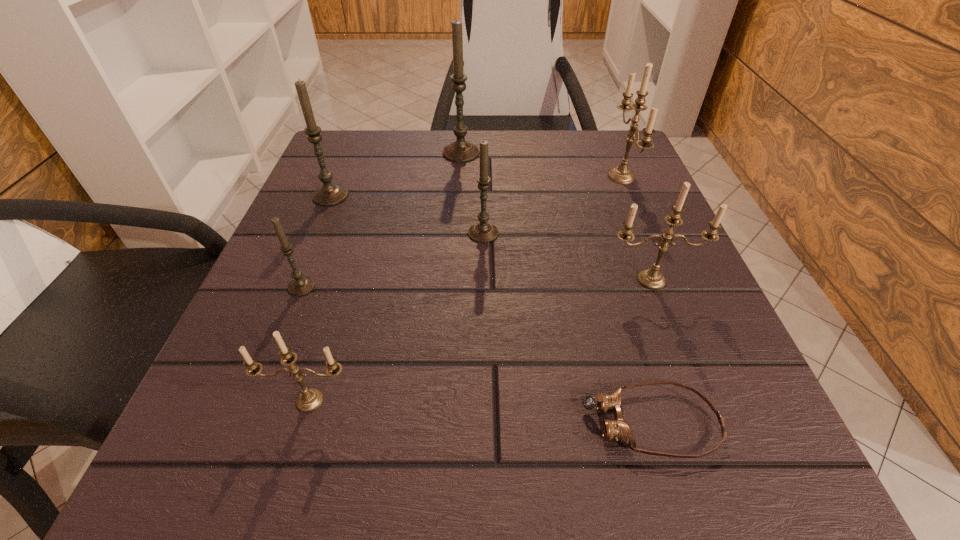
The image size is (960, 540). I want to click on vacant region that satisfies the following two spatial constraints: 1. on the back side of the nearest metallic candle; 2. on the left side of the third biggest gray candle, so click(360, 233).